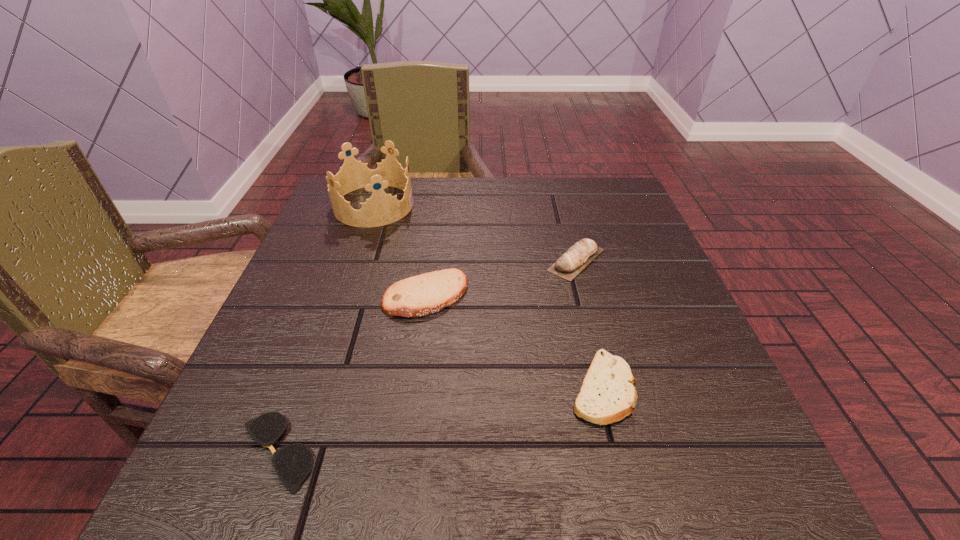
The image size is (960, 540). Find the location of `free space at the far right corner of the desktop`. free space at the far right corner of the desktop is located at coordinates (579, 188).

Find the location of `vacant space that is in between the nearest pita bread and the tallest object`. vacant space that is in between the nearest pita bread and the tallest object is located at coordinates (488, 297).

The width and height of the screenshot is (960, 540). I want to click on vacant area that lies between the shortest pita bread and the leftmost pita bread, so click(x=515, y=342).

The image size is (960, 540). I want to click on vacant region between the shortest object and the tiara, so click(324, 328).

The width and height of the screenshot is (960, 540). In order to click on free space between the shortest pita bread and the spectacles in this screenshot , I will do `click(440, 420)`.

I want to click on free space between the nearest pita bread and the tiara, so click(x=488, y=297).

Locate an element on the screen. The image size is (960, 540). vacant space that is in between the nearest pita bread and the tallest object is located at coordinates (488, 297).

Identify the location of empty space that is in between the shortest pita bread and the leftmost pita bread. This screenshot has height=540, width=960. (515, 342).

This screenshot has height=540, width=960. In order to click on vacant area between the shortest pita bread and the tiara in this screenshot , I will do pos(488,297).

At what (x,y) coordinates should I click in order to perform the action: click on free spot between the leftmost pita bread and the shortest pita bread. Please return your answer as a coordinate pair (x, y). Image resolution: width=960 pixels, height=540 pixels. Looking at the image, I should click on (515, 342).